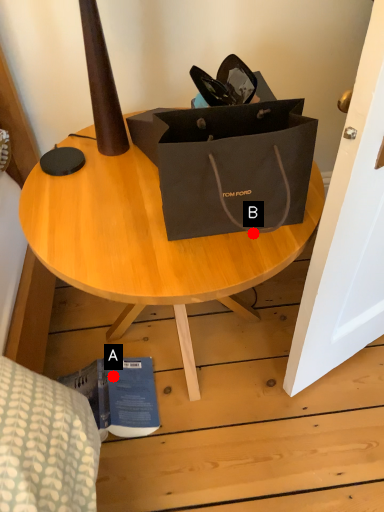
Question: Two points are circled on the image, labeled by A and B beside each circle. Which point is further to the camera?

Choices:
 (A) A is further
 (B) B is further

Answer: (A)